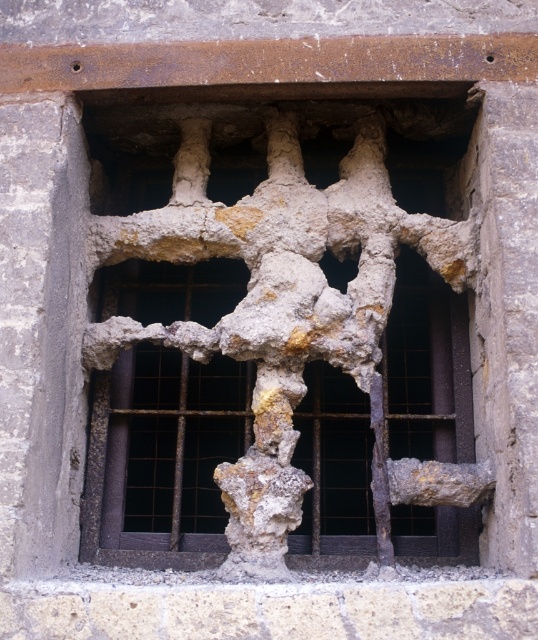
Does point (130, 529) lie in front of point (332, 269)?

Yes, point (130, 529) is closer to viewer.

Who is more distant from viewer, [407,211] or [330,273]?

The point [407,211] is more distant.

This screenshot has height=640, width=538. What are the coordinates of `crumbly stone sculpture at center` in the screenshot? It's located at (281, 342).

Identify the location of crumbly stone sculpture at center. The image size is (538, 640). (281, 342).